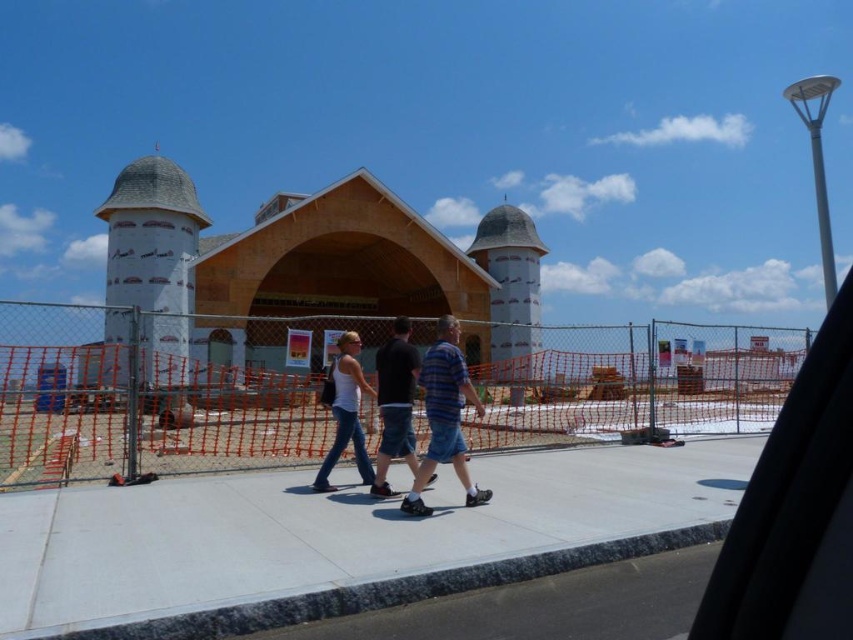
You are a construction worker standing at point A, which is at coordinate point (799, 390). You need to walk to point B, located at coordinate point (433, 476). According to the scene, which direction should you move to reach point B from point A?

To reach point B from point A, you should move towards the lower right direction since point A is in front of point B, meaning point B is behind point A in the scene.

From the picture: You are standing at the construction site and want to take a photo of the building with the transparent glass car window at upper right in the background. Can you fit the entire building into the photo without moving your position? The camera you are using has a standard 50mm lens with a field of view of 46 degrees.

The transparent glass car window at upper right is 26.36 inches from the viewer. With a 50mm lens and a 46 degree field of view, the distance to the window may be too close for the entire building to fit into the frame. You might need to step back or use a wider lens to capture the whole building.